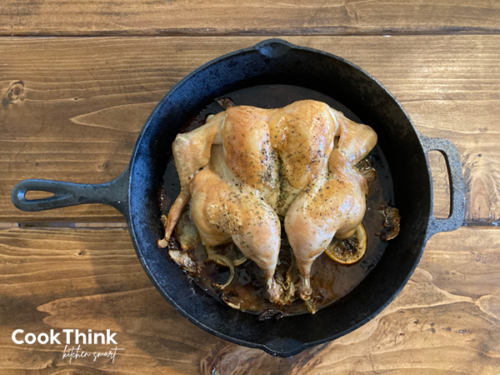
This screenshot has width=500, height=375. I want to click on wooden table, so click(430, 306).